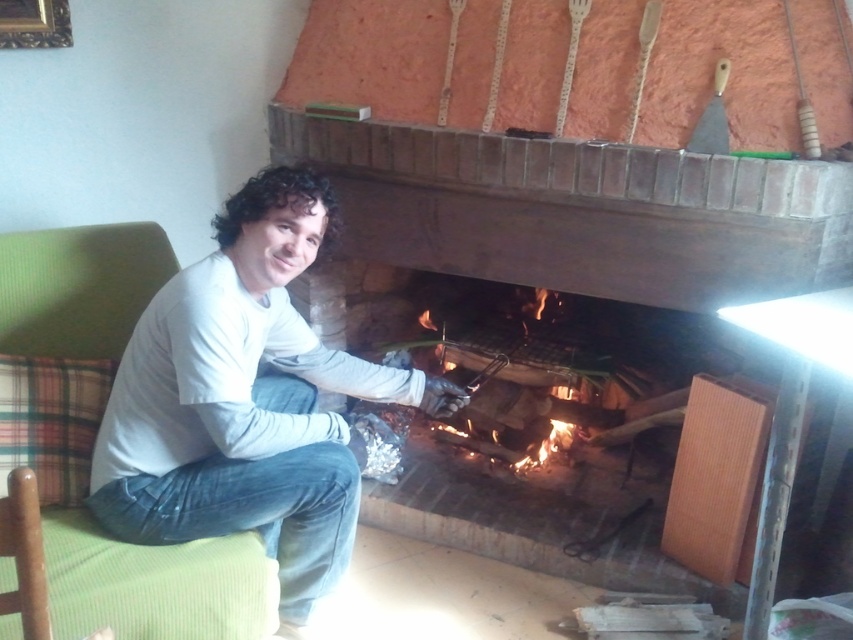
You are standing in the room and see the point at coordinates (245, 401). What object is located at that point?

The point at coordinates (245, 401) corresponds to the white matte shirt at center.

You are a guest in this living room and want to sit down. You see the white matte shirt at center and the green fabric armchair at left. Which object is closer to you as you approach the fireplace?

The white matte shirt at center is closer to you because the green fabric armchair at left is behind it.

You are trying to decide whether to place a decorative pillow on the white matte shirt at center or the green fabric armchair at left. Based on their sizes, which object would allow the pillow to fit better?

The white matte shirt at center has a larger width than the green fabric armchair at left, so the pillow would fit better on the white matte shirt at center.